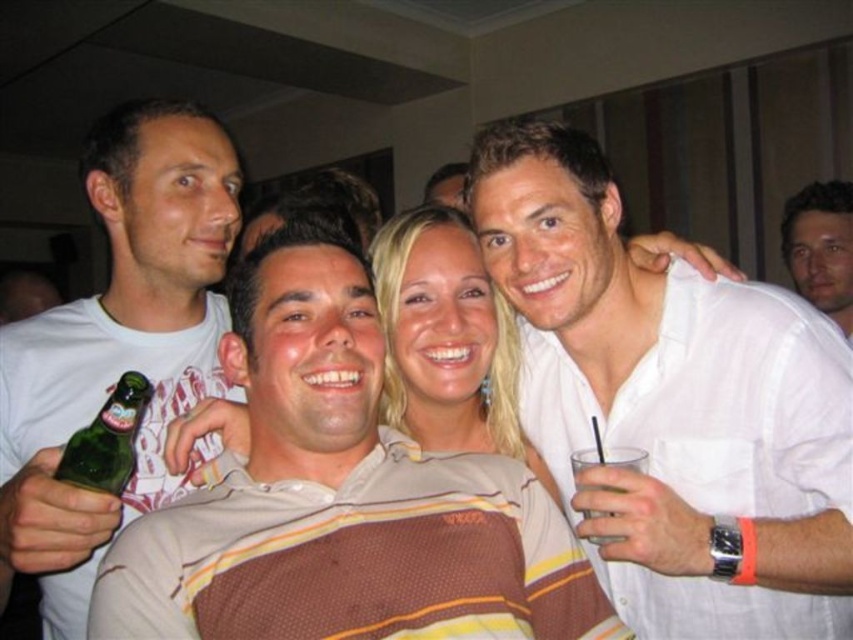
In the scene shown: You are a bartender trying to serve a drink to the person wearing the white cotton shirt at upper right. The clear plastic cup at upper right is already on the table. Where should you place the new drink to avoid blocking their view?

Place the new drink behind the clear plastic cup at upper right so it doesn not block the white cotton shirt at upper right view since the white cotton shirt at upper right is currently in front of the clear plastic cup at upper right.